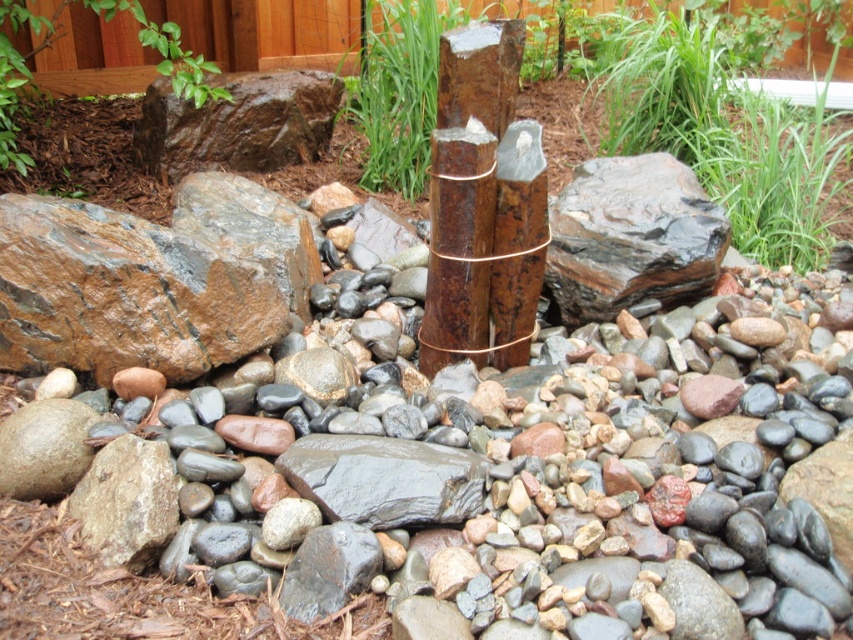
Which of these two, shiny black rock at center-right or shiny gray rock at center, stands shorter?

shiny gray rock at center

Does shiny black rock at center-right have a smaller size compared to shiny gray rock at center?

Incorrect, shiny black rock at center-right is not smaller in size than shiny gray rock at center.

Does point (554, 198) come in front of point (383, 438)?

No, it is not.

I want to click on shiny black rock at center-right, so click(x=631, y=236).